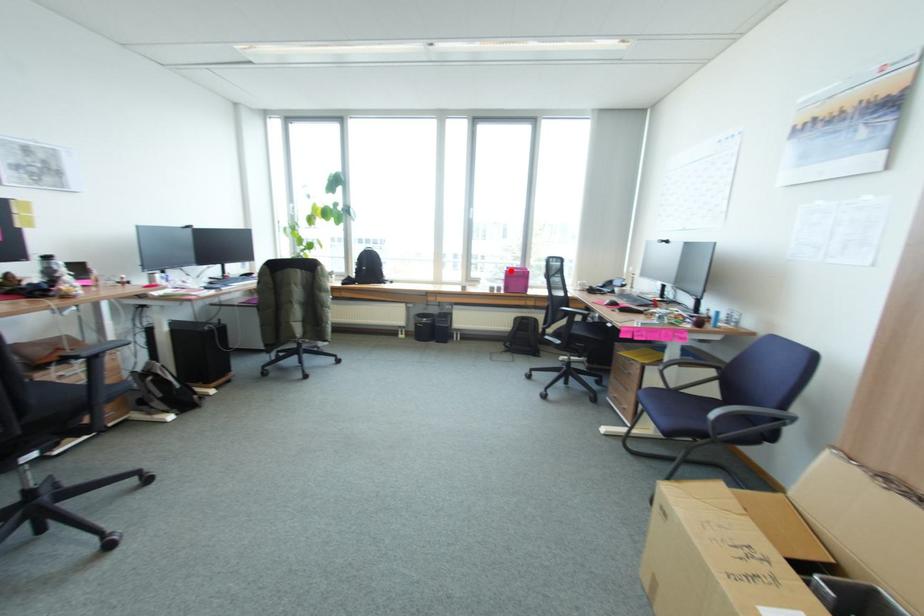
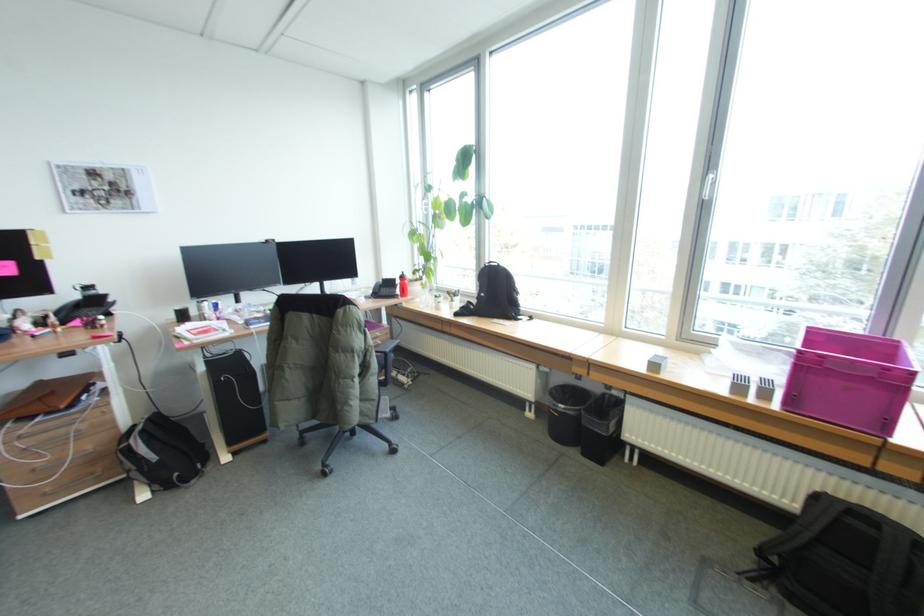
The point at the highlighted location is marked in the first image. Where is the corresponding point in the second image?

(803, 350)